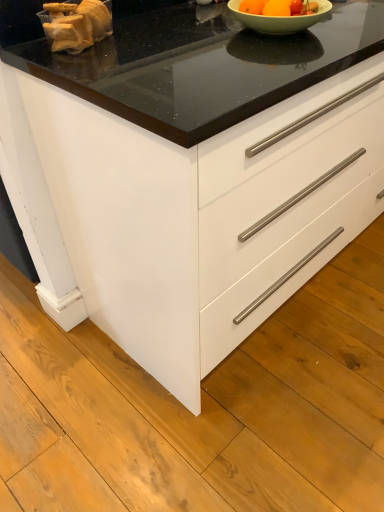
This screenshot has width=384, height=512. What do you see at coordinates (76, 25) in the screenshot? I see `matte brown croissant at upper left` at bounding box center [76, 25].

At what (x,y) coordinates should I click in order to perform the action: click on matte brown croissant at upper left. Please return your answer as a coordinate pair (x, y). Image resolution: width=384 pixels, height=512 pixels. Looking at the image, I should click on (76, 25).

What is the approximate width of matte brown croissant at upper left?

It is 5.29 inches.

Find the location of a particular element. matte brown croissant at upper left is located at coordinates (76, 25).